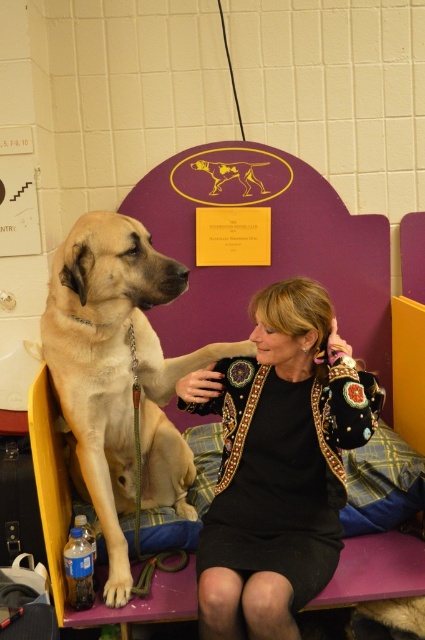
Question: Can you confirm if black textured jacket at center is wider than light brown fur at left?

Choices:
 (A) no
 (B) yes

Answer: (A)

Question: Does black textured jacket at center appear on the left side of light brown fur at left?

Choices:
 (A) no
 (B) yes

Answer: (A)

Question: Among these points, which one is farthest from the camera?

Choices:
 (A) pyautogui.click(x=178, y=273)
 (B) pyautogui.click(x=322, y=419)

Answer: (B)

Question: Which of the following is the closest to the observer?

Choices:
 (A) (266, 458)
 (B) (110, 513)

Answer: (A)

Question: Which point is closer to the camera?

Choices:
 (A) (121, 406)
 (B) (305, 442)

Answer: (B)

Question: Is black textured jacket at center below light brown fur at left?

Choices:
 (A) no
 (B) yes

Answer: (B)